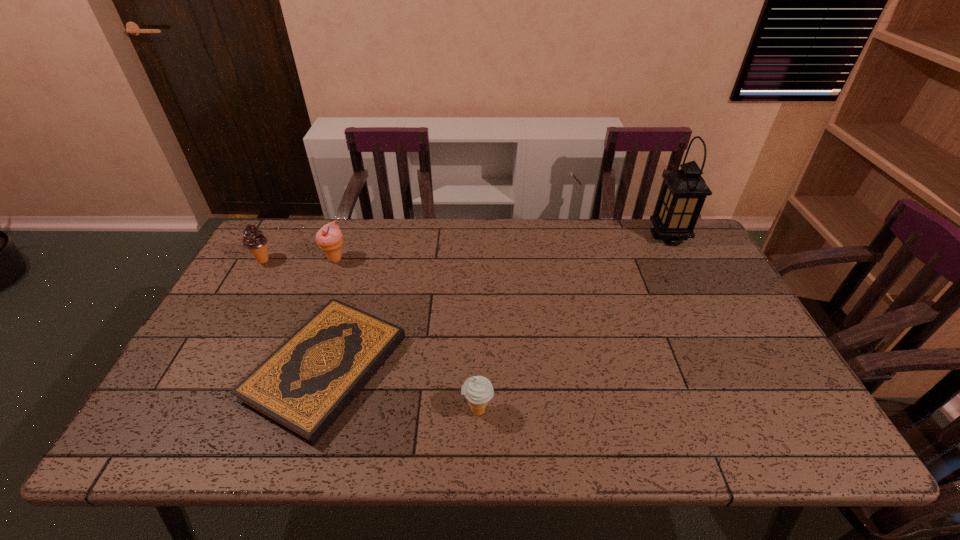
This screenshot has width=960, height=540. What are the coordinates of `free location located on the right of the rightmost icecream` in the screenshot? It's located at (667, 410).

At what (x,y) coordinates should I click in order to perform the action: click on vacant point located on the left of the shortest object. Please return your answer as a coordinate pair (x, y). This screenshot has height=540, width=960. Looking at the image, I should click on (208, 368).

You are a GUI agent. You are given a task and a screenshot of the screen. Output one action in this format:
    pyautogui.click(x=<x>, y=<y>)
    Task: Click on the lantern that is positioned at the far edge
    
    Given the screenshot: What is the action you would take?
    pyautogui.click(x=684, y=191)

Where is `icecream at the near edge`? icecream at the near edge is located at coordinates (478, 390).

Where is `hardback book located at the near edge`? The width and height of the screenshot is (960, 540). hardback book located at the near edge is located at coordinates (303, 386).

Find the location of a particular element. The width and height of the screenshot is (960, 540). object that is at the left edge is located at coordinates (254, 240).

Identify the location of object at the right edge. (684, 191).

Where is `object at the far left corner`? object at the far left corner is located at coordinates (254, 240).

At what (x,y) coordinates should I click in order to perform the action: click on object at the far right corner. Please return your answer as a coordinate pair (x, y). Looking at the image, I should click on (684, 191).

Find the location of `vacant space at the far edge`. vacant space at the far edge is located at coordinates (315, 253).